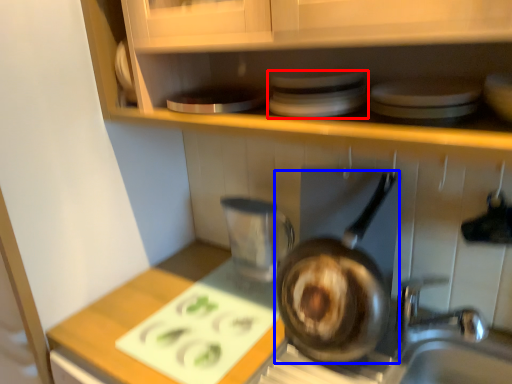
Question: Which of the following is the closest to the observer, appliance (highlighted by a red box) or frying pan (highlighted by a blue box)?

Choices:
 (A) appliance
 (B) frying pan

Answer: (A)